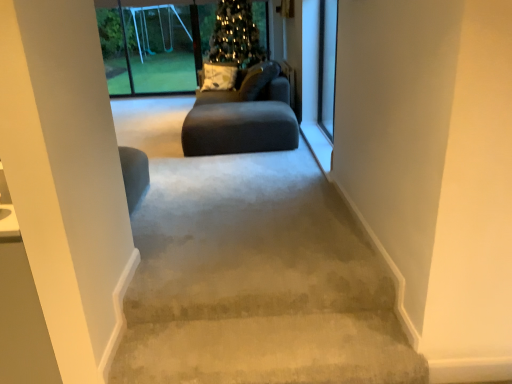
Question: Does point (162, 74) appear closer or farther from the camera than point (251, 91)?

Choices:
 (A) farther
 (B) closer

Answer: (A)

Question: Would you say transparent plastic swing set at upper left, which appears as the 2th screen door when viewed from the front, is to the left or to the right of dark gray fabric couch at center in the picture?

Choices:
 (A) left
 (B) right

Answer: (A)

Question: Considering the real-world distances, which object is closest to the dark gray fabric couch at center?

Choices:
 (A) clear glass screen door at upper right, which is the 2th screen door from left to right
 (B) transparent plastic swing set at upper left, the 1th screen door positioned from the back
 (C) matte gray couch at center

Answer: (C)

Question: Considering the real-world distances, which object is farthest from the clear glass screen door at upper right, which is the 2th screen door from left to right?

Choices:
 (A) matte gray couch at center
 (B) transparent plastic swing set at upper left, the first screen door when ordered from left to right
 (C) dark gray fabric couch at center

Answer: (B)